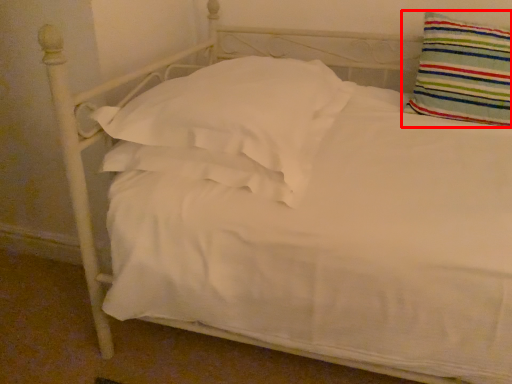
Question: In this image, where is pillow (annotated by the red box) located relative to pillow?

Choices:
 (A) left
 (B) right

Answer: (B)